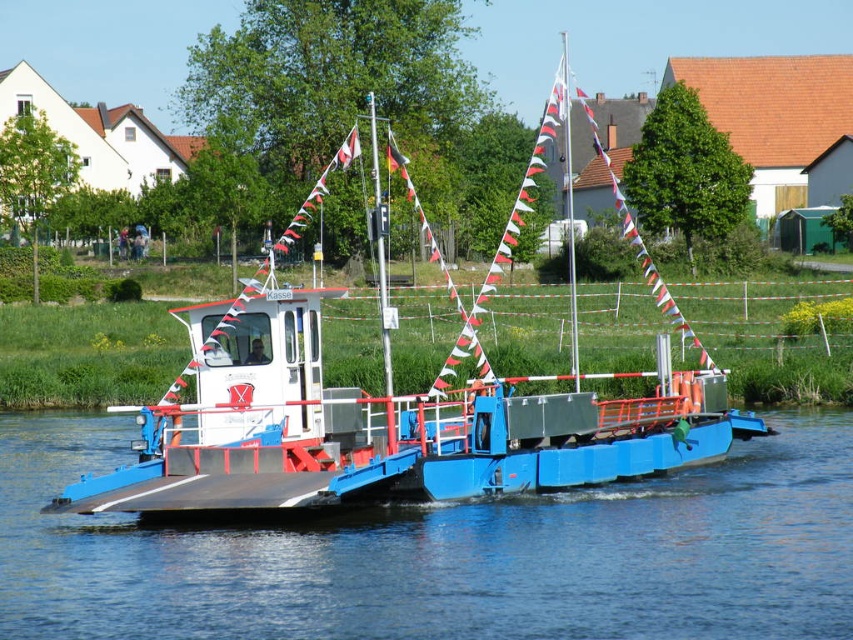
Question: Does blue metallic river at center appear on the right side of blue matte ferryboat at center?

Choices:
 (A) yes
 (B) no

Answer: (A)

Question: Which of the following is the closest to the observer?

Choices:
 (A) blue matte ferryboat at center
 (B) blue metallic river at center

Answer: (B)

Question: Is blue metallic river at center bigger than blue matte ferryboat at center?

Choices:
 (A) yes
 (B) no

Answer: (B)

Question: Does blue metallic river at center appear under blue matte ferryboat at center?

Choices:
 (A) yes
 (B) no

Answer: (A)